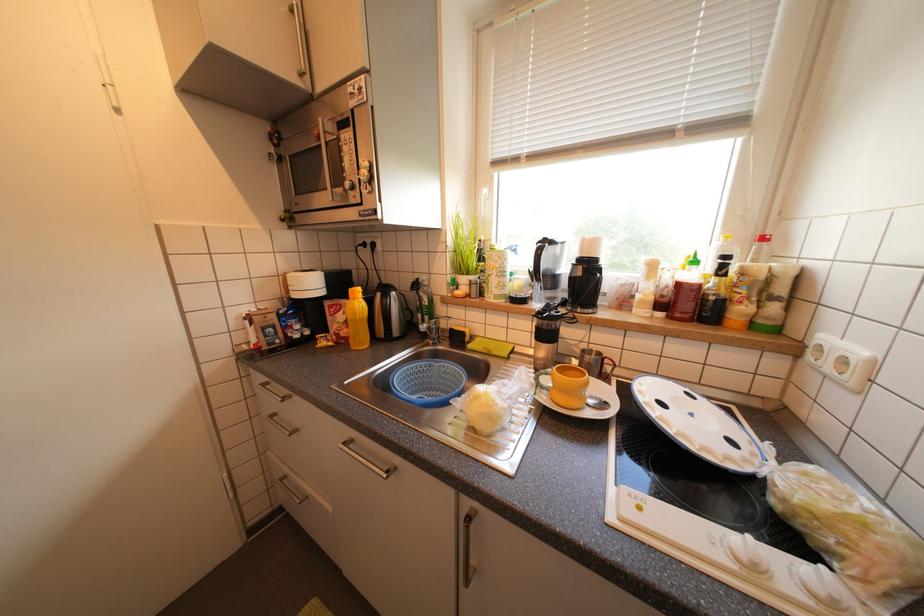
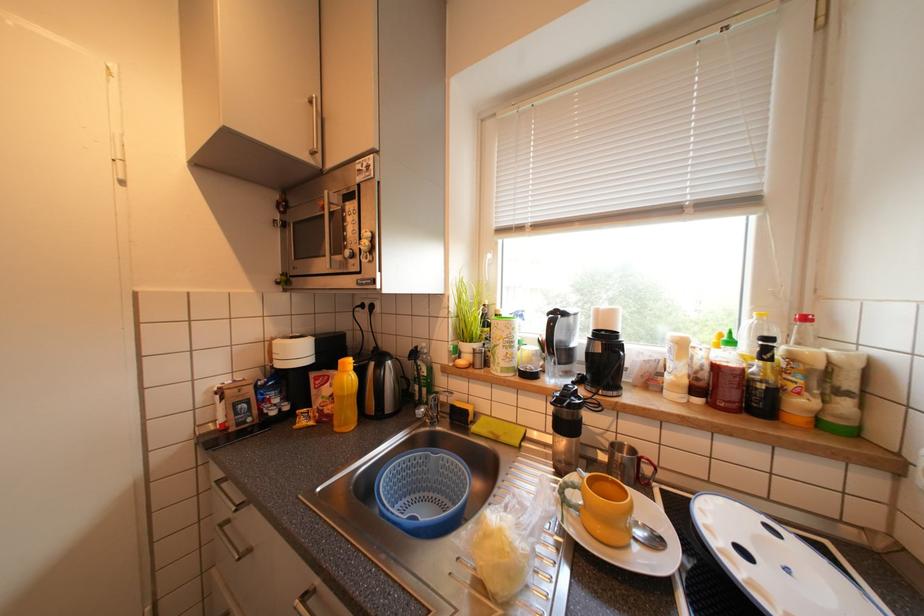
Question: How did the camera likely rotate?

Choices:
 (A) Left
 (B) Right
 (C) Up
 (D) Down

Answer: (C)